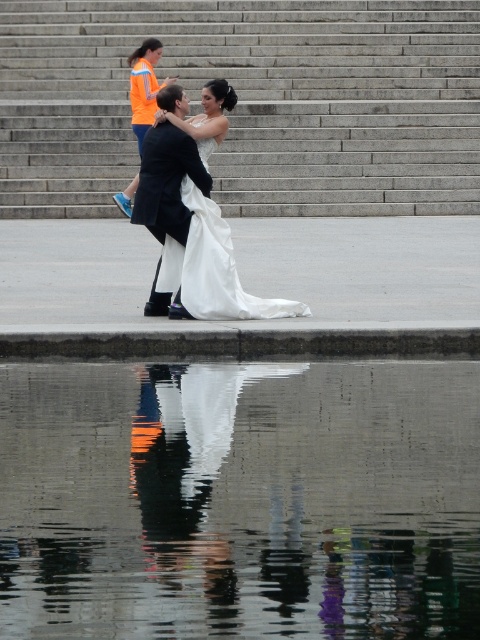
Which is below, glossy reflective water at center or white satin dress at center?

Positioned lower is glossy reflective water at center.

The height and width of the screenshot is (640, 480). I want to click on glossy reflective water at center, so click(240, 499).

Identify the location of glossy reflective water at center. point(240,499).

Describe the element at coordinates (189, 476) in the screenshot. I see `white glossy dress at center` at that location.

Between white glossy dress at center and orange fabric safety vest at upper left, which one appears on the left side from the viewer's perspective?

Positioned to the left is orange fabric safety vest at upper left.

Image resolution: width=480 pixels, height=640 pixels. I want to click on white glossy dress at center, so click(189, 476).

You are a GUI agent. You are given a task and a screenshot of the screen. Output one action in this format:
    pyautogui.click(x=<x>, y=<y>)
    Task: Click on the white glossy dress at center
    Image resolution: width=480 pixels, height=640 pixels.
    Given the screenshot: What is the action you would take?
    pyautogui.click(x=189, y=476)

Is gray concrete stairs at center below shiny black suit at center?

No.

Does point (467, 29) come behind point (159, 257)?

Yes, it is.

This screenshot has height=640, width=480. I want to click on gray concrete stairs at center, so click(x=249, y=102).